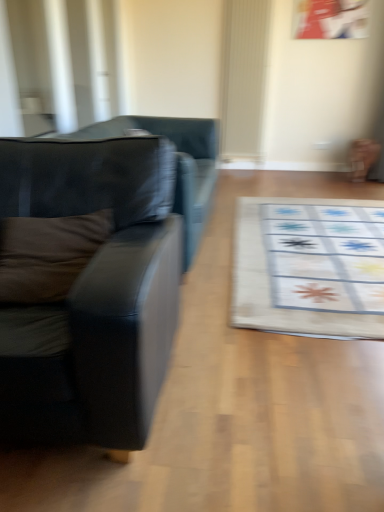
Question: Is black leather couch at left, placed as the 2th studio couch when sorted from back to front, behind brown fabric pillow at left?

Choices:
 (A) no
 (B) yes

Answer: (A)

Question: Is black leather couch at left, which is the 1th studio couch in front-to-back order, taller than brown fabric pillow at left?

Choices:
 (A) yes
 (B) no

Answer: (A)

Question: Is black leather couch at left, placed as the 2th studio couch when sorted from back to front, bigger than brown fabric pillow at left?

Choices:
 (A) no
 (B) yes

Answer: (B)

Question: Is black leather couch at left, which is the 1th studio couch in front-to-back order, at the left side of brown fabric pillow at left?

Choices:
 (A) no
 (B) yes

Answer: (B)

Question: Does black leather couch at left, which is the 1th studio couch in front-to-back order, have a greater width compared to brown fabric pillow at left?

Choices:
 (A) no
 (B) yes

Answer: (B)

Question: Is the position of black leather couch at left, placed as the 2th studio couch when sorted from back to front, less distant than that of brown fabric pillow at left?

Choices:
 (A) no
 (B) yes

Answer: (B)

Question: Considering the relative sizes of matte black couch at left, arranged as the 1th studio couch when viewed from the back, and black leather couch at left, which is the 1th studio couch in front-to-back order, in the image provided, is matte black couch at left, arranged as the 1th studio couch when viewed from the back, taller than black leather couch at left, which is the 1th studio couch in front-to-back order,?

Choices:
 (A) no
 (B) yes

Answer: (A)

Question: From a real-world perspective, does matte black couch at left, which ranks as the 2th studio couch in front-to-back order, sit lower than black leather couch at left, placed as the 2th studio couch when sorted from back to front?

Choices:
 (A) no
 (B) yes

Answer: (B)

Question: From the image's perspective, is matte black couch at left, arranged as the 1th studio couch when viewed from the back, under black leather couch at left, placed as the 2th studio couch when sorted from back to front?

Choices:
 (A) no
 (B) yes

Answer: (A)

Question: Considering the relative positions of matte black couch at left, arranged as the 1th studio couch when viewed from the back, and black leather couch at left, placed as the 2th studio couch when sorted from back to front, in the image provided, is matte black couch at left, arranged as the 1th studio couch when viewed from the back, behind black leather couch at left, placed as the 2th studio couch when sorted from back to front,?

Choices:
 (A) no
 (B) yes

Answer: (B)

Question: Is matte black couch at left, which ranks as the 2th studio couch in front-to-back order, far from black leather couch at left, placed as the 2th studio couch when sorted from back to front?

Choices:
 (A) no
 (B) yes

Answer: (A)

Question: Is the position of matte black couch at left, arranged as the 1th studio couch when viewed from the back, less distant than that of black leather couch at left, which is the 1th studio couch in front-to-back order?

Choices:
 (A) no
 (B) yes

Answer: (A)

Question: Is black leather couch at left, which is the 1th studio couch in front-to-back order, at the back of brown fabric pillow at left?

Choices:
 (A) yes
 (B) no

Answer: (A)